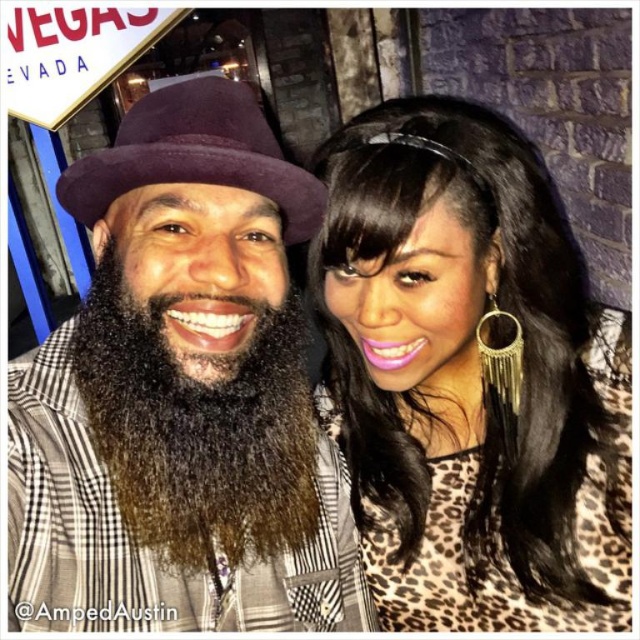
Between matte purple hat at center and dark brown fuzzy beard at center, which one has less height?

dark brown fuzzy beard at center is shorter.

Which is more to the left, matte purple hat at center or dark brown fuzzy beard at center?

matte purple hat at center

Does point (276, 164) come behind point (157, 492)?

No, it is in front of (157, 492).

In order to click on matte purple hat at center in this screenshot , I will do `click(180, 396)`.

Is leopard print blouse at center above dark brown fuzzy beard at center?

Correct, leopard print blouse at center is located above dark brown fuzzy beard at center.

Is point (352, 445) behind point (145, 483)?

Yes.

Who is more forward, (612, 358) or (172, 518)?

Point (172, 518) is more forward.

Where is `leopard print blouse at center`? Image resolution: width=640 pixels, height=640 pixels. leopard print blouse at center is located at coordinates (472, 378).

Does point (138, 300) come farther from viewer compared to point (426, 419)?

No, (138, 300) is in front of (426, 419).

Which is in front, point (141, 536) or point (486, 237)?

Positioned in front is point (141, 536).

Identify the location of matte purple hat at center. The width and height of the screenshot is (640, 640). tap(180, 396).